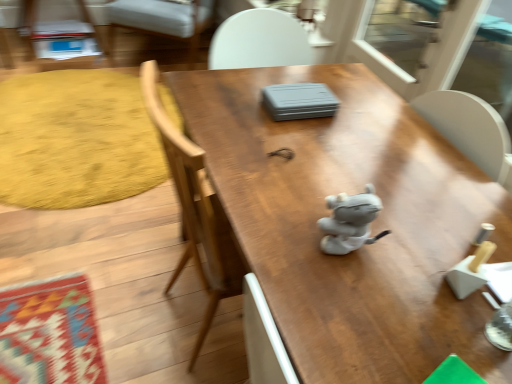
Find the location of a particular element. The width and height of the screenshot is (512, 384). blank area beneath yellow textured rug at left (from a real-world perspective) is located at coordinates (90, 122).